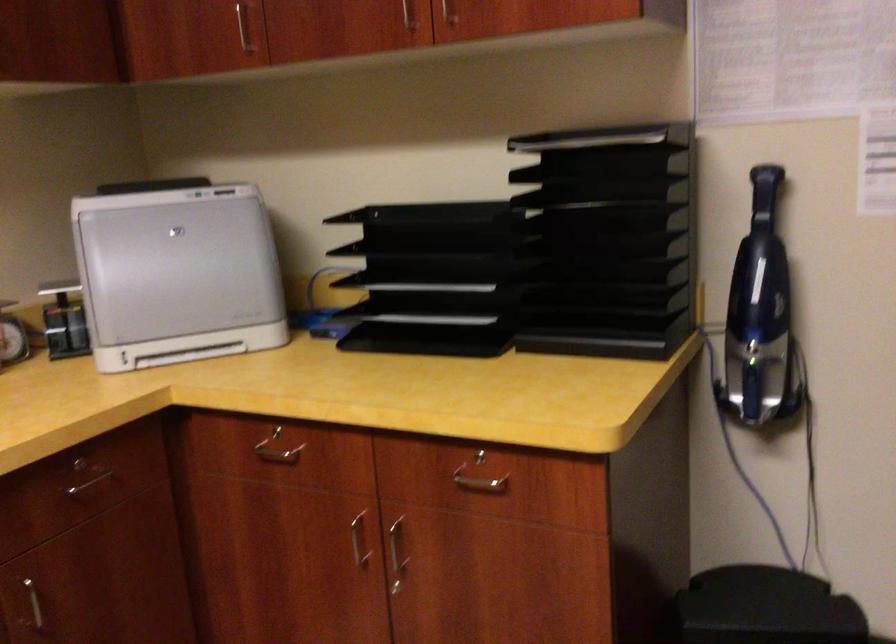
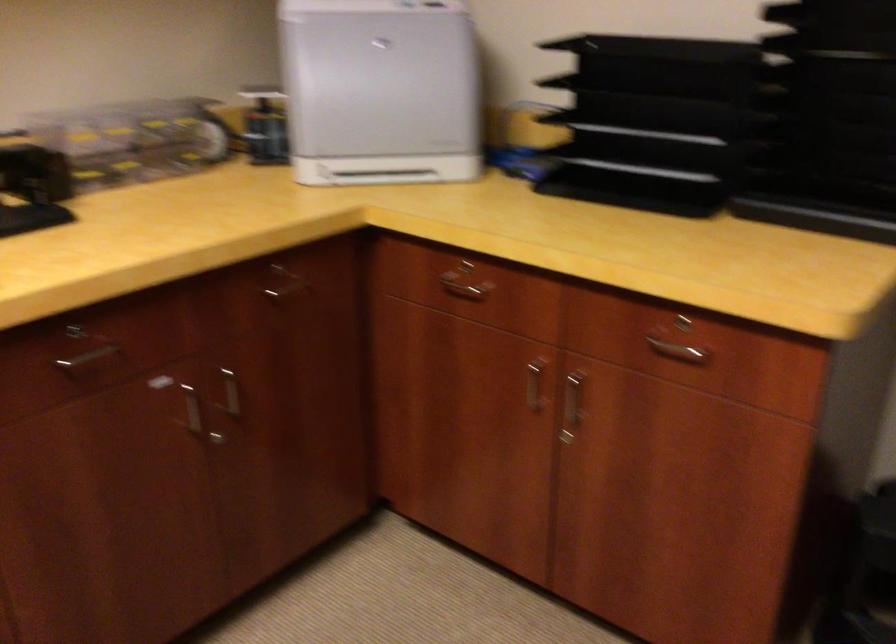
The point at [279,447] is marked in the first image. Where is the corresponding point in the second image?

(464, 281)